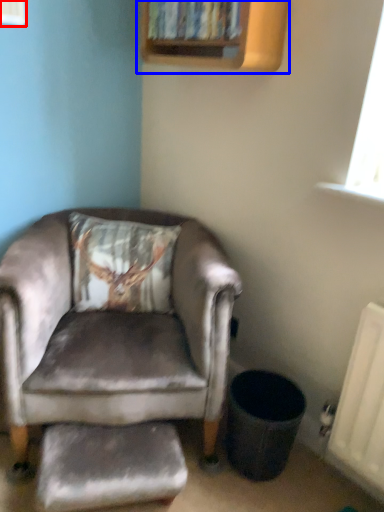
Question: Which point is closer to the camera, window (highlighted by a red box) or bookshelf (highlighted by a blue box)?

Choices:
 (A) window
 (B) bookshelf

Answer: (A)